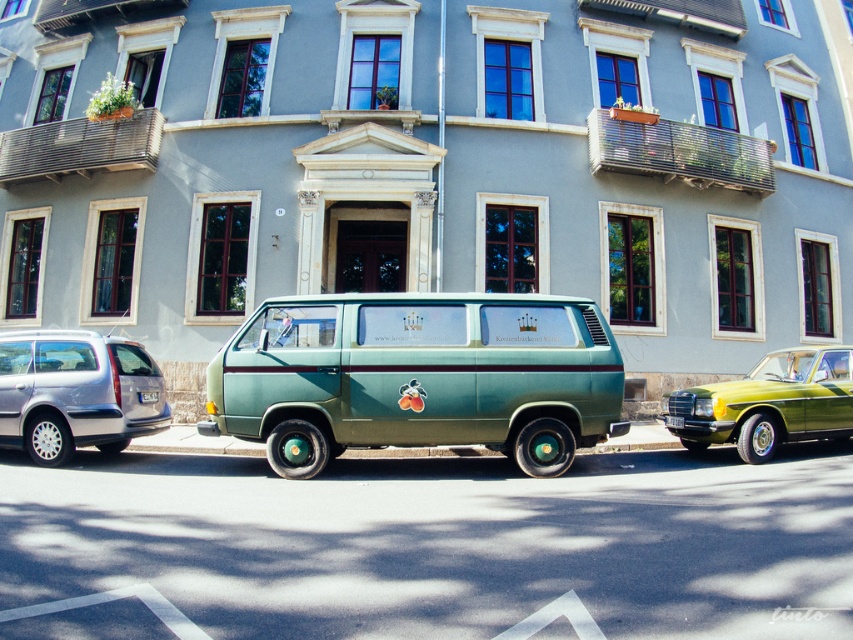
Looking at this image, you are a delivery person trying to park your truck in the space between the metallic green sedan at right and the green matte license plate at center. Based on the scene, can you estimate whether there is enough vertical clearance between these two objects to safely park your truck?

The metallic green sedan at right is below the green matte license plate at center, so there is vertical clearance between them. However, without knowing the exact height of your truck, it is difficult to determine if there is enough space. Please measure the height of your truck and compare it to the distance between the metallic green sedan at right and the green matte license plate at center.

You are a delivery driver who needs to park your truck between the green matte van at center and the satin silver minivan at left. According to the scene, can you park your truck there?

The green matte van at center is positioned over the satin silver minivan at left, so there is no space between them for the truck to park.